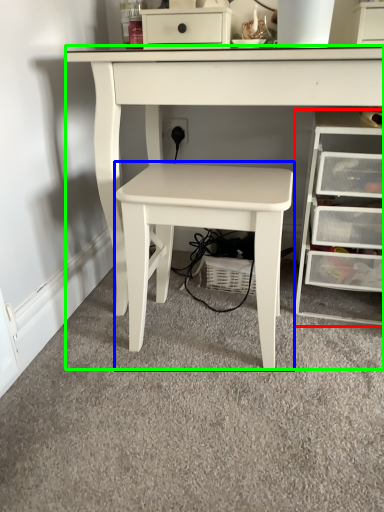
Question: Which is nearer to the chest of drawers (highlighted by a red box)? table (highlighted by a blue box) or table (highlighted by a green box).

Choices:
 (A) table
 (B) table

Answer: (A)